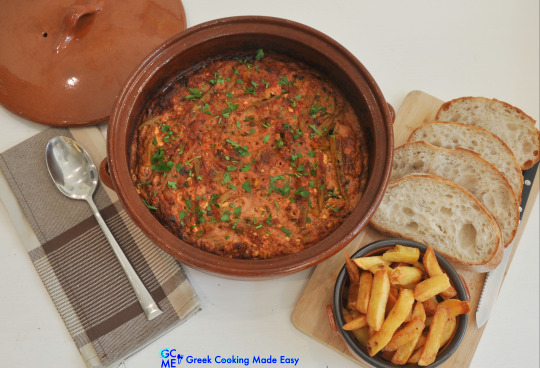
Find the location of a particular element. cutting board is located at coordinates [x=317, y=318].